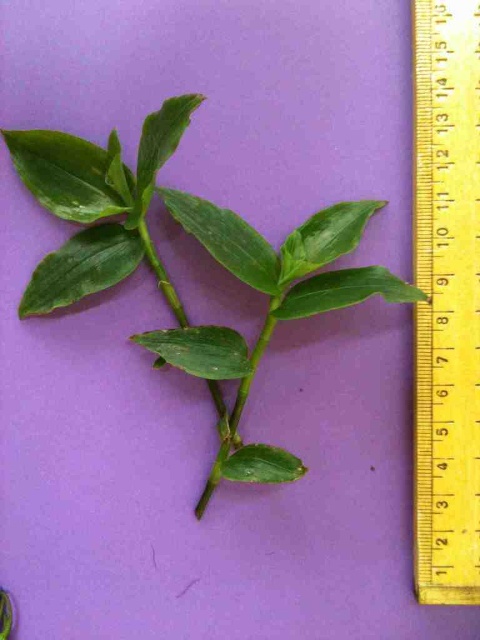
This screenshot has height=640, width=480. Describe the element at coordinates (204, 248) in the screenshot. I see `green matte leafy branch at center` at that location.

Which is behind, point (141, 193) or point (446, 184)?

The point (141, 193) is more distant.

The height and width of the screenshot is (640, 480). I want to click on green matte leafy branch at center, so click(x=204, y=248).